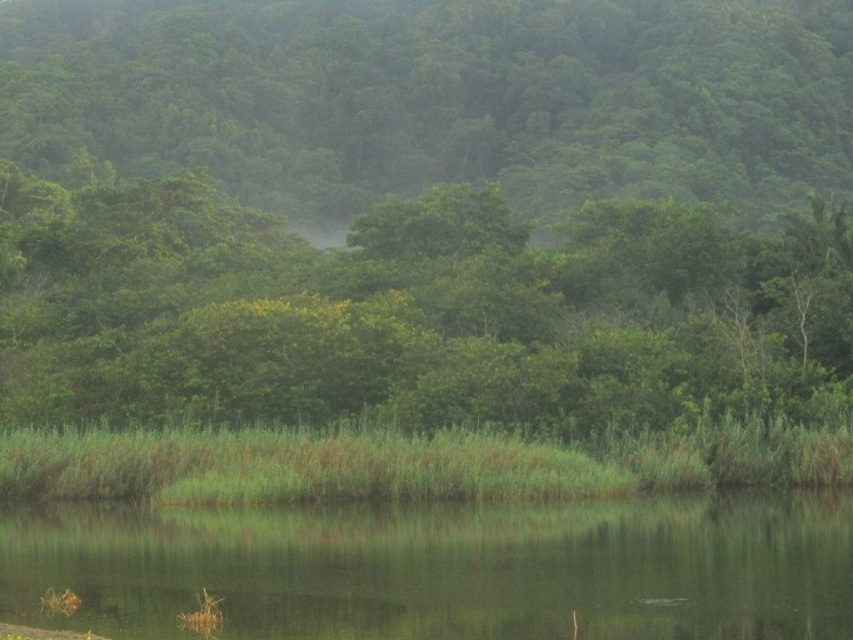
Question: Which point appears closest to the camera in this image?

Choices:
 (A) (117, 8)
 (B) (593, 609)

Answer: (B)

Question: Can you confirm if green leafy tree at center is positioned to the left of green smooth water at lower center?

Choices:
 (A) yes
 (B) no

Answer: (B)

Question: Observing the image, what is the correct spatial positioning of green leafy tree at center in reference to green smooth water at lower center?

Choices:
 (A) below
 (B) above

Answer: (B)

Question: Which point is farther to the camera?

Choices:
 (A) green leafy tree at center
 (B) green smooth water at lower center

Answer: (A)

Question: Is green leafy tree at center to the left of green smooth water at lower center from the viewer's perspective?

Choices:
 (A) no
 (B) yes

Answer: (A)